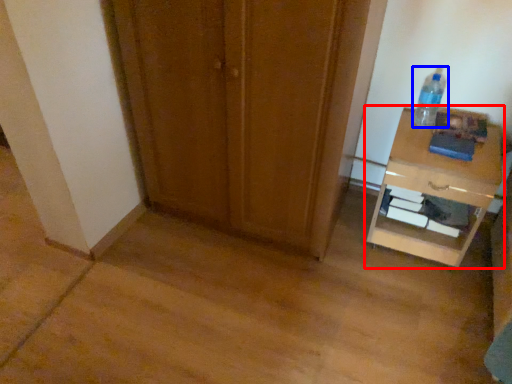
Question: Which object appears closest to the camera in this image, nightstand (highlighted by a red box) or bottle (highlighted by a blue box)?

Choices:
 (A) nightstand
 (B) bottle

Answer: (A)